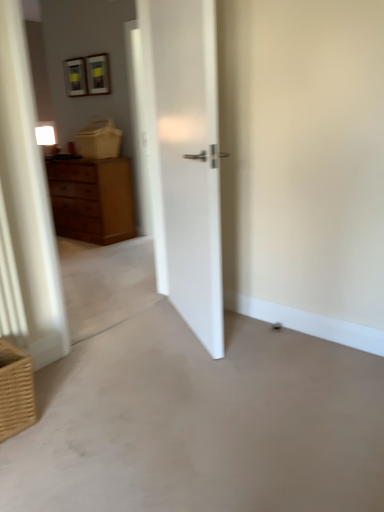
Question: From a real-world perspective, relative to brown woven basket at lower left, is wooden chest of drawers at left vertically above or below?

Choices:
 (A) above
 (B) below

Answer: (A)

Question: From the image's perspective, is wooden chest of drawers at left above or below brown woven basket at lower left?

Choices:
 (A) above
 (B) below

Answer: (A)

Question: Which of these objects is positioned closest to the wooden chest of drawers at left?

Choices:
 (A) smooth concrete floor at center
 (B) brown woven basket at lower left

Answer: (A)

Question: Which object is the farthest from the brown woven basket at lower left?

Choices:
 (A) smooth concrete floor at center
 (B) wooden chest of drawers at left

Answer: (B)